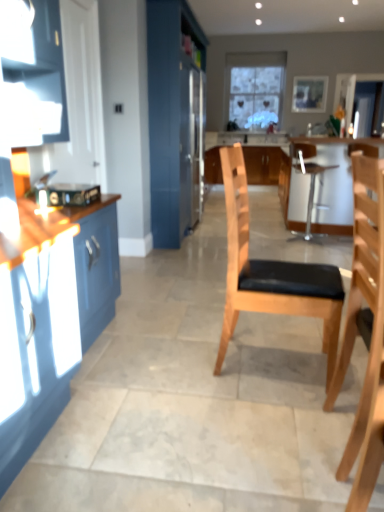
I want to click on vacant region to the left of light wood/black cushioned chair at center, placed as the first chair when sorted from left to right, so click(185, 365).